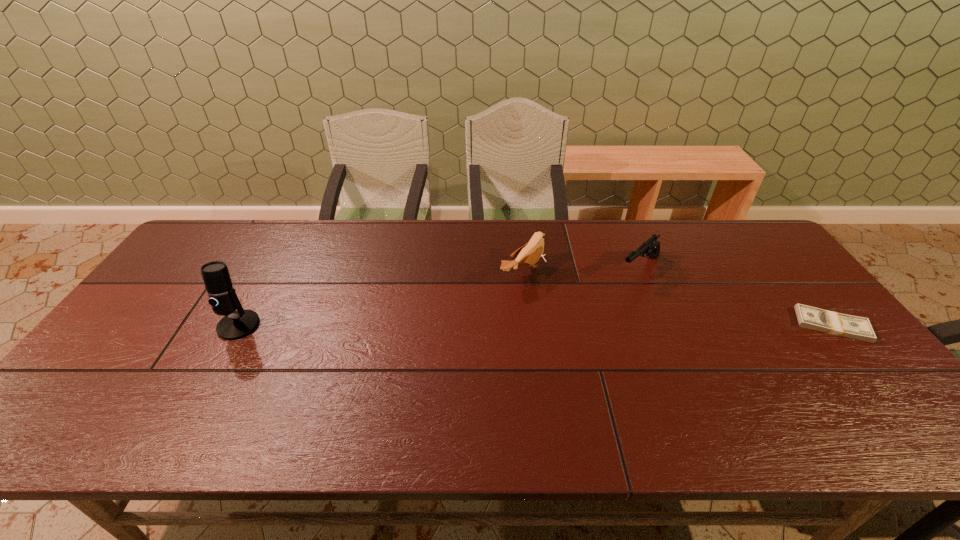
Where is `free space that is in between the tallest object and the bird`? free space that is in between the tallest object and the bird is located at coordinates (381, 299).

Locate an element on the screen. This screenshot has height=540, width=960. empty location between the third object from right to left and the gun is located at coordinates (582, 270).

Where is `unoccupied area between the gun and the second object from left to right`? The width and height of the screenshot is (960, 540). unoccupied area between the gun and the second object from left to right is located at coordinates (582, 270).

The height and width of the screenshot is (540, 960). I want to click on object that is the third closest to the second object from right to left, so click(234, 325).

Identify which object is located as the nearest to the third object from left to right. Please provide its 2D coordinates. Your answer should be formatted as a tuple, i.e. [(x, y)], where the tuple contains the x and y coordinates of a point satisfying the conditions above.

[(530, 253)]

The width and height of the screenshot is (960, 540). I want to click on free spot that satisfies the following two spatial constraints: 1. on the front side of the bird; 2. on the left side of the rightmost object, so click(x=530, y=325).

This screenshot has width=960, height=540. Identify the location of free space that satisfies the following two spatial constraints: 1. on the back side of the shortest object; 2. on the left side of the tallest object. (239, 325).

The height and width of the screenshot is (540, 960). Identify the location of free location that satisfies the following two spatial constraints: 1. on the back side of the tallest object; 2. on the right side of the shortest object. (239, 325).